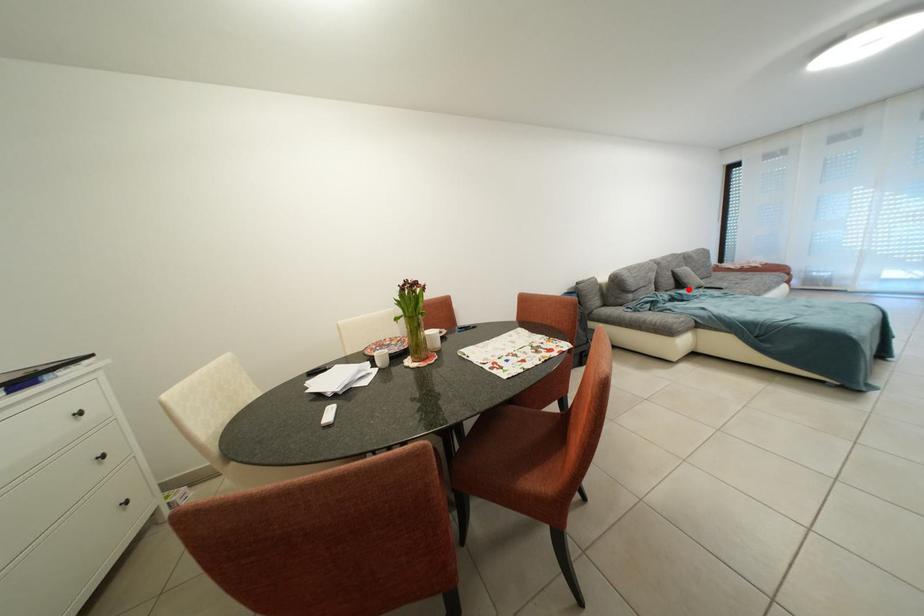
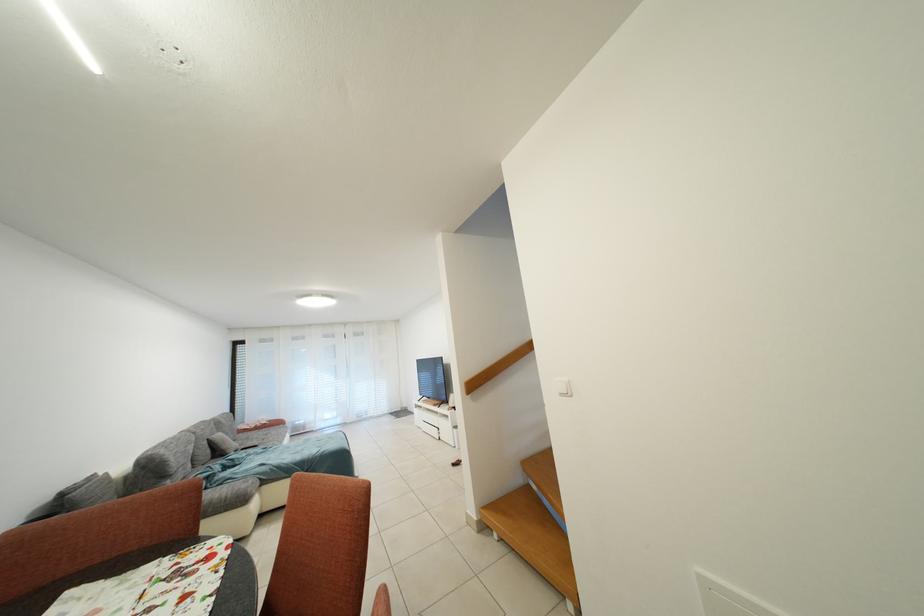
Locate, in the second image, the point that corresponds to the highlighted location in the first image.

(226, 456)